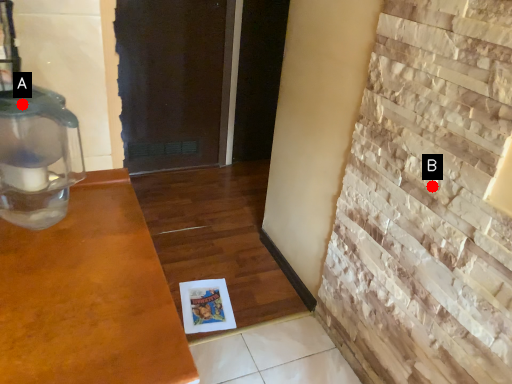
Question: Two points are circled on the image, labeled by A and B beside each circle. Which point is closer to the camera?

Choices:
 (A) A is closer
 (B) B is closer

Answer: (A)